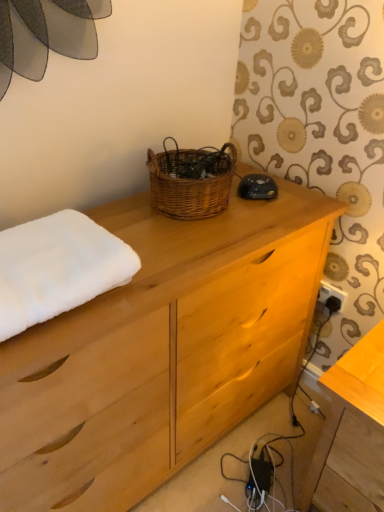
Question: Is the position of woven brown basket at center less distant than that of wooden table at lower right?

Choices:
 (A) yes
 (B) no

Answer: (B)

Question: Is woven brown basket at center turned away from wooden table at lower right?

Choices:
 (A) yes
 (B) no

Answer: (B)

Question: Is woven brown basket at center smaller than wooden table at lower right?

Choices:
 (A) yes
 (B) no

Answer: (A)

Question: Can you confirm if woven brown basket at center is bigger than wooden table at lower right?

Choices:
 (A) yes
 (B) no

Answer: (B)

Question: From a real-world perspective, is woven brown basket at center positioned over wooden table at lower right based on gravity?

Choices:
 (A) no
 (B) yes

Answer: (B)

Question: From the image's perspective, is natural wood chest of drawers at center located above or below woven brown basket at center?

Choices:
 (A) above
 (B) below

Answer: (B)

Question: Is natural wood chest of drawers at center spatially inside woven brown basket at center, or outside of it?

Choices:
 (A) outside
 (B) inside

Answer: (A)

Question: Based on their positions, is natural wood chest of drawers at center located to the left or right of woven brown basket at center?

Choices:
 (A) left
 (B) right

Answer: (A)

Question: In terms of height, does natural wood chest of drawers at center look taller or shorter compared to woven brown basket at center?

Choices:
 (A) tall
 (B) short

Answer: (A)

Question: From the image's perspective, is natural wood chest of drawers at center positioned above or below white fluffy towel at left?

Choices:
 (A) above
 (B) below

Answer: (B)

Question: Considering the positions of natural wood chest of drawers at center and white fluffy towel at left in the image, is natural wood chest of drawers at center bigger or smaller than white fluffy towel at left?

Choices:
 (A) small
 (B) big

Answer: (B)

Question: Is natural wood chest of drawers at center to the left or to the right of white fluffy towel at left in the image?

Choices:
 (A) left
 (B) right

Answer: (B)

Question: In the image, is natural wood chest of drawers at center positioned in front of or behind white fluffy towel at left?

Choices:
 (A) behind
 (B) front

Answer: (B)

Question: In terms of size, does woven brown basket at center appear bigger or smaller than wooden table at lower right?

Choices:
 (A) big
 (B) small

Answer: (B)

Question: From the image's perspective, relative to wooden table at lower right, is woven brown basket at center above or below?

Choices:
 (A) below
 (B) above

Answer: (B)